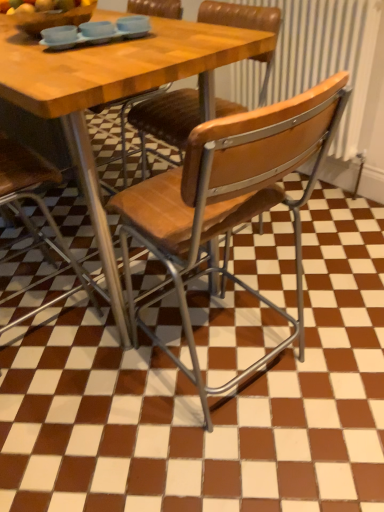
Where is `vacant space in front of wooden seat at center, which is the 2th chair in left-to-right order`? The width and height of the screenshot is (384, 512). vacant space in front of wooden seat at center, which is the 2th chair in left-to-right order is located at coordinates (230, 285).